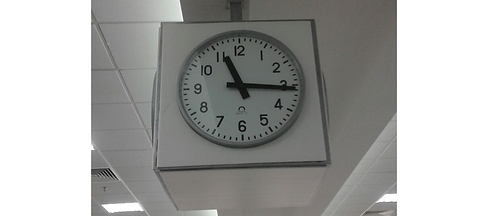
At what (x,y) coordinates should I click in order to perform the action: click on white ceiling. Please return your answer as a coordinate pair (x, y). This screenshot has width=502, height=216. Looking at the image, I should click on (119, 99).